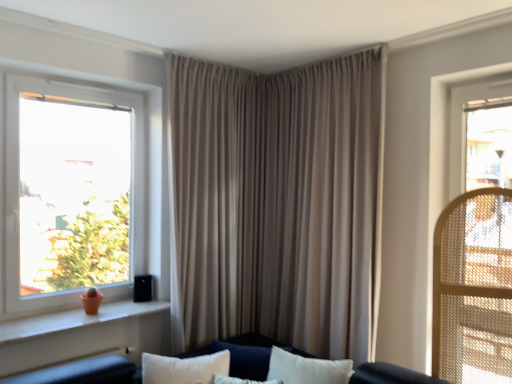
What do you see at coordinates (73, 193) in the screenshot? I see `white plastic window at left` at bounding box center [73, 193].

Where is `orange clay pot at left`? This screenshot has height=384, width=512. orange clay pot at left is located at coordinates pyautogui.click(x=74, y=320).

Considering the sizes of beige fabric curtain at center and velvet dark blue couch at center in the image, is beige fabric curtain at center wider or thinner than velvet dark blue couch at center?

In the image, beige fabric curtain at center appears to be more narrow than velvet dark blue couch at center.

Would you say beige fabric curtain at center is inside or outside velvet dark blue couch at center?

beige fabric curtain at center lies outside velvet dark blue couch at center.

Is beige fabric curtain at center in contact with velvet dark blue couch at center?

No, beige fabric curtain at center is not beside velvet dark blue couch at center.

In the scene shown: Considering the positions of objects beige fabric curtain at center and velvet dark blue couch at center in the image provided, who is in front, beige fabric curtain at center or velvet dark blue couch at center?

velvet dark blue couch at center is more forward.

Is velvet dark blue couch at center placed right next to beige fabric curtain at center?

There is a gap between velvet dark blue couch at center and beige fabric curtain at center.

Is velvet dark blue couch at center positioned beyond the bounds of beige fabric curtain at center?

Yes, velvet dark blue couch at center is outside of beige fabric curtain at center.

From the image's perspective, is velvet dark blue couch at center positioned above or below beige fabric curtain at center?

From the image's perspective, velvet dark blue couch at center appears below beige fabric curtain at center.

From a real-world perspective, which is physically above, velvet dark blue couch at center or beige fabric curtain at center?

beige fabric curtain at center, from a real-world perspective.

Is white plastic window at left oriented away from velvet dark blue couch at center?

white plastic window at left does not have its back to velvet dark blue couch at center.

Would you say white plastic window at left is a long distance from velvet dark blue couch at center?

That's right, there is a large distance between white plastic window at left and velvet dark blue couch at center.

Which of these two, white plastic window at left or velvet dark blue couch at center, is thinner?

Thinner between the two is white plastic window at left.

How far apart are white plastic window at left and velvet dark blue couch at center?

white plastic window at left and velvet dark blue couch at center are 3.44 feet apart from each other.

Locate an element on the screen. curtain on the right of the white plastic window at left is located at coordinates (277, 203).

Does beige fabric curtain at center have a lesser width compared to white plastic window at left?

No, beige fabric curtain at center is not thinner than white plastic window at left.

Looking at this image, is beige fabric curtain at center located outside white plastic window at left?

Indeed, beige fabric curtain at center is completely outside white plastic window at left.

Which is in front, white plastic window at left or beige fabric curtain at center?

white plastic window at left is closer to the camera.

Considering the positions of point (60, 217) and point (203, 295), is point (60, 217) closer or farther from the camera than point (203, 295)?

Point (60, 217) appears to be closer to the viewer than point (203, 295).

Measure the distance from white plastic window at left to beige fabric curtain at center.

white plastic window at left is 31.11 inches away from beige fabric curtain at center.

From the image's perspective, does white plastic window at left appear lower than beige fabric curtain at center?

No, from the image's perspective, white plastic window at left is not beneath beige fabric curtain at center.

What are the coordinates of `window that is behind the orange clay pot at left` in the screenshot? It's located at coord(73,193).

Could you tell me if white plastic window at left is facing orange clay pot at left?

Yes, white plastic window at left is facing orange clay pot at left.

Which object is positioned more to the right, white plastic window at left or orange clay pot at left?

From the viewer's perspective, orange clay pot at left appears more on the right side.

How many degrees apart are the facing directions of white plastic window at left and orange clay pot at left?

The angle between the facing direction of white plastic window at left and the facing direction of orange clay pot at left is 0.273 degrees.

Is orange clay pot at left surrounding velvet dark blue couch at center?

No, velvet dark blue couch at center is located outside of orange clay pot at left.

Image resolution: width=512 pixels, height=384 pixels. I want to click on couch located on the right of orange clay pot at left, so click(86, 372).

From a real-world perspective, is orange clay pot at left positioned above or below velvet dark blue couch at center?

orange clay pot at left is situated higher than velvet dark blue couch at center in the real world.

Identify the location of curtain above the velvet dark blue couch at center (from the image's perspective). The width and height of the screenshot is (512, 384). (277, 203).

At what (x,y) coordinates should I click in order to perform the action: click on curtain located on the right of velvet dark blue couch at center. Please return your answer as a coordinate pair (x, y). Looking at the image, I should click on (277, 203).

Which object lies further to the anchor point orange clay pot at left, velvet dark blue couch at center or white plastic window at left?

Based on the image, white plastic window at left appears to be further to orange clay pot at left.

Considering their positions, is white plastic window at left positioned further to orange clay pot at left than beige fabric curtain at center?

beige fabric curtain at center lies further to orange clay pot at left than the other object.

Looking at the image, which one is located further to beige fabric curtain at center, orange clay pot at left or white plastic window at left?

orange clay pot at left is positioned further to the anchor beige fabric curtain at center.

Considering their positions, is velvet dark blue couch at center positioned closer to white plastic window at left than beige fabric curtain at center?

The object closer to white plastic window at left is beige fabric curtain at center.

Consider the image. Estimate the real-world distances between objects in this image. Which object is closer to beige fabric curtain at center, velvet dark blue couch at center or orange clay pot at left?

orange clay pot at left is closer to beige fabric curtain at center.

Looking at the image, which one is located closer to velvet dark blue couch at center, orange clay pot at left or beige fabric curtain at center?

orange clay pot at left is positioned closer to the anchor velvet dark blue couch at center.

Considering their positions, is beige fabric curtain at center positioned further to orange clay pot at left than white plastic window at left?

beige fabric curtain at center.

Considering their positions, is white plastic window at left positioned further to velvet dark blue couch at center than beige fabric curtain at center?

Among the two, beige fabric curtain at center is located further to velvet dark blue couch at center.

Locate an element on the screen. Image resolution: width=512 pixels, height=384 pixels. couch located between orange clay pot at left and beige fabric curtain at center in the left-right direction is located at coordinates (86, 372).

Locate an element on the screen. This screenshot has height=384, width=512. window sill located between white plastic window at left and velvet dark blue couch at center in the left-right direction is located at coordinates (74, 320).

Find the location of a particular element. The width and height of the screenshot is (512, 384). couch situated between white plastic window at left and beige fabric curtain at center from left to right is located at coordinates (86, 372).

What are the coordinates of `window sill between white plastic window at left and beige fabric curtain at center from left to right` in the screenshot? It's located at (74, 320).